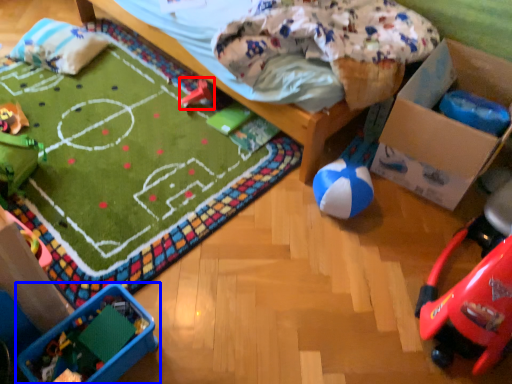
Question: Among these objects, which one is farthest to the camera, toy (highlighted by a red box) or toy (highlighted by a blue box)?

Choices:
 (A) toy
 (B) toy

Answer: (A)